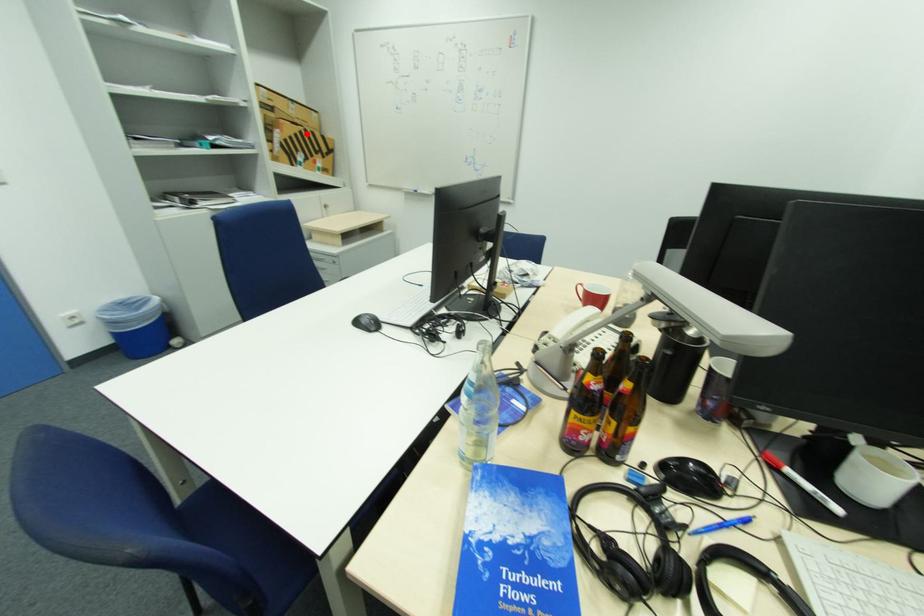
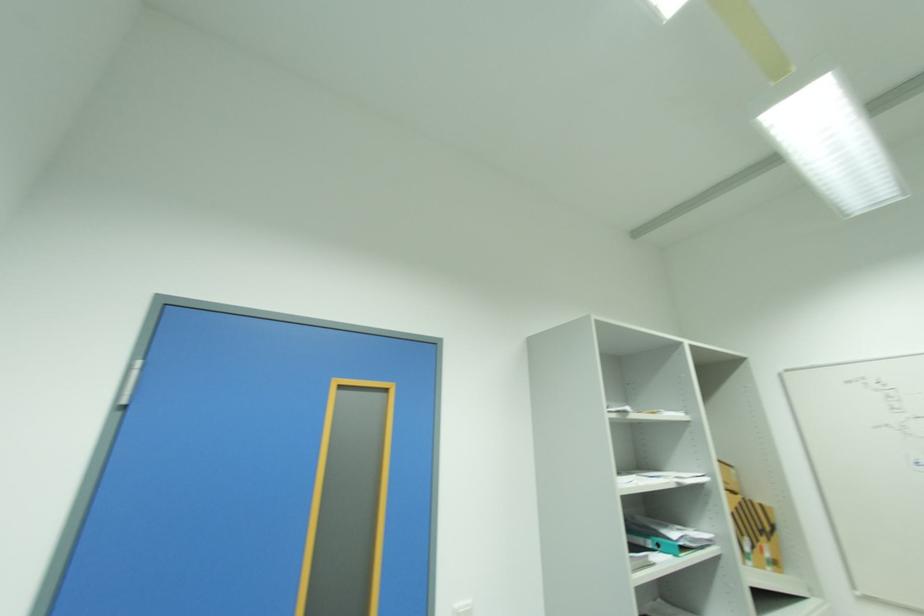
Find the pixel in the second image that matches the highlighted location in the first image.

(746, 506)